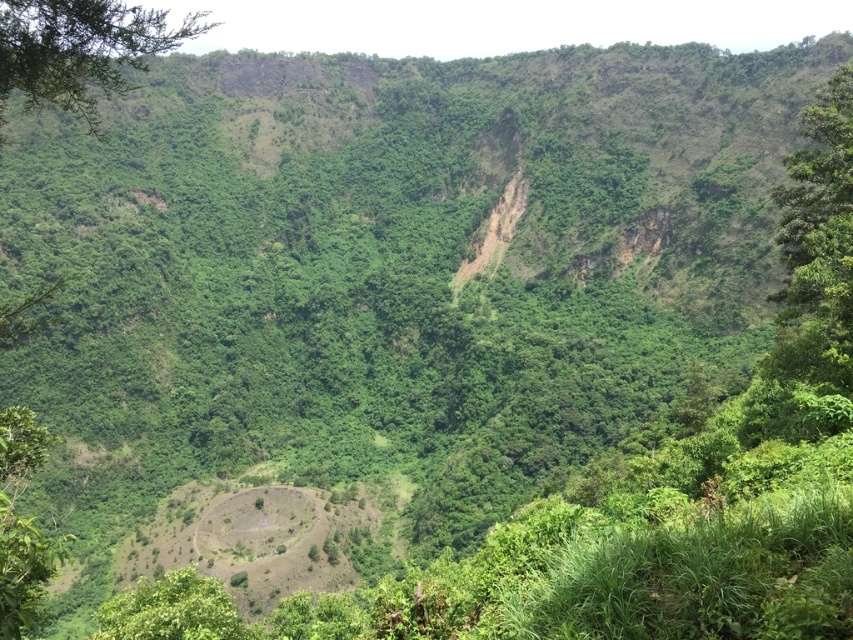
Between green leafy tree at right and green leafy tree at upper left, which one has less height?

green leafy tree at right

Which of these two, green leafy tree at right or green leafy tree at upper left, stands taller?

Standing taller between the two is green leafy tree at upper left.

This screenshot has height=640, width=853. Identify the location of green leafy tree at right. (817, 244).